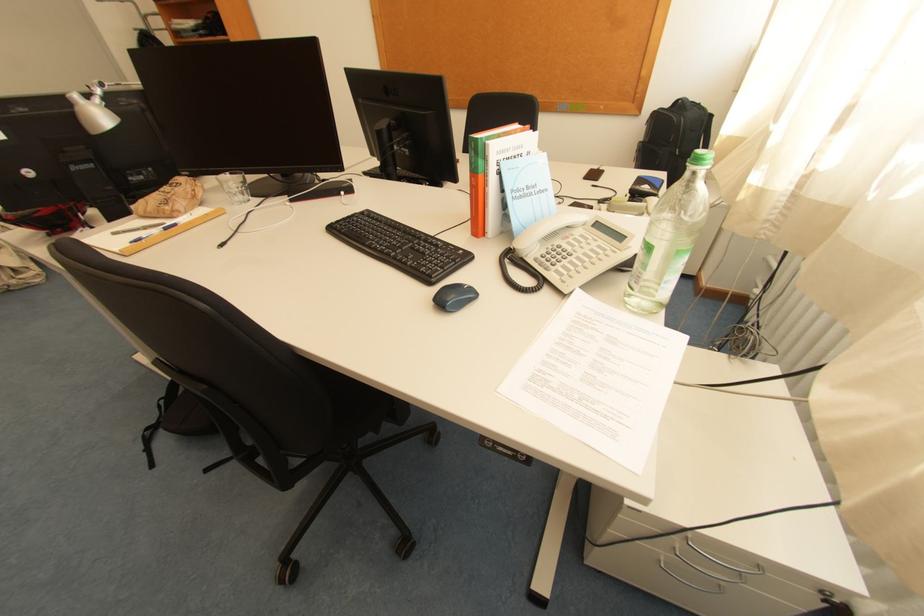
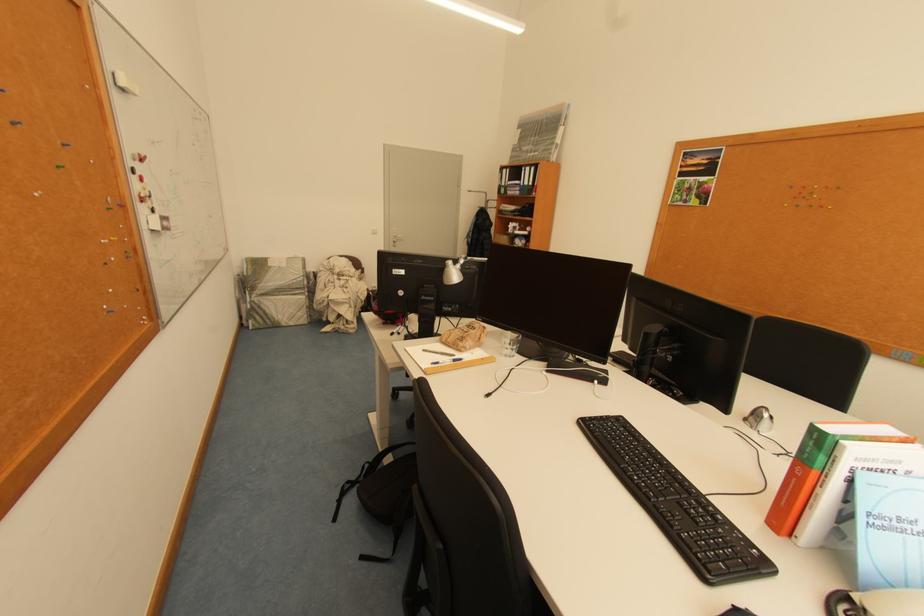
The point at (186, 184) is marked in the first image. Where is the corresponding point in the second image?

(481, 328)